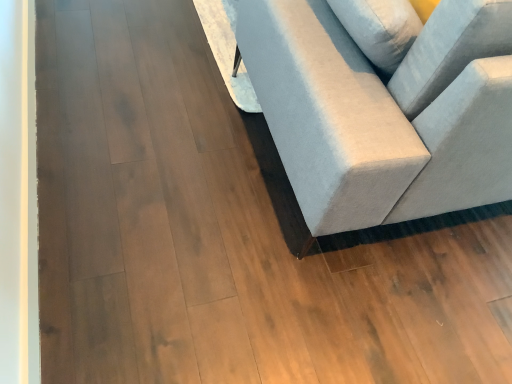
The image size is (512, 384). Identify the location of light gray fabric couch at right. (381, 116).

Describe the element at coordinates (381, 116) in the screenshot. I see `light gray fabric couch at right` at that location.

Where is `light gray fabric couch at right`? light gray fabric couch at right is located at coordinates (381, 116).